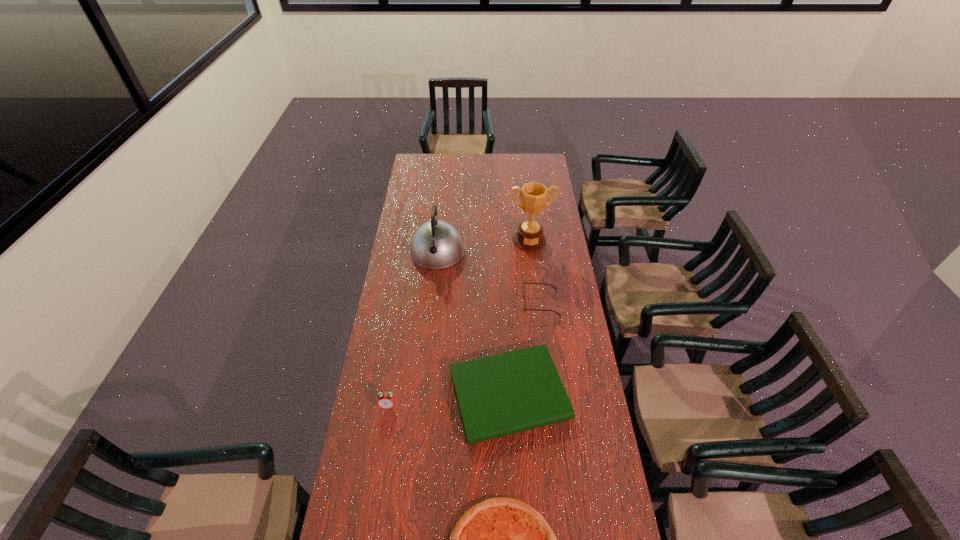
Find the location of `award`. award is located at coordinates pyautogui.click(x=529, y=237).

You are a GUI agent. You are given a task and a screenshot of the screen. Output one action in this format:
    pyautogui.click(x=<x>, y=<y>)
    Task: Click on the fifth shortest object
    This screenshot has height=540, width=960.
    Given the screenshot: What is the action you would take?
    pyautogui.click(x=436, y=244)

Identify the location of alarm clock. The height and width of the screenshot is (540, 960). (386, 400).

Where is `the third farthest object`? The height and width of the screenshot is (540, 960). the third farthest object is located at coordinates (525, 309).

You are a GUI agent. You are given a task and a screenshot of the screen. Output one action in this format:
    pyautogui.click(x=<x>, y=<y>)
    Task: Click on the spectacles
    
    Given the screenshot: What is the action you would take?
    pyautogui.click(x=525, y=309)

This screenshot has height=540, width=960. Find the location of `paperback book`. paperback book is located at coordinates (497, 395).

You are a GUI agent. You are given a task and a screenshot of the screen. Output one action in this format:
    pyautogui.click(x=<x>, y=<y>)
    Task: Click on the vacant space situated on the front-facing side of the tallest object
    Image resolution: width=960 pixels, height=540 pixels.
    Given the screenshot: What is the action you would take?
    pyautogui.click(x=538, y=308)

In order to click on free space located 0.220m from the spout of the kettle in this screenshot , I will do (432, 306).

Locate an element on the screen. vacant space located on the front-facing side of the alarm clock is located at coordinates (375, 488).

The image size is (960, 540). What are the coordinates of `free location located on the front-facing side of the fourth tallest object` in the screenshot? It's located at (492, 302).